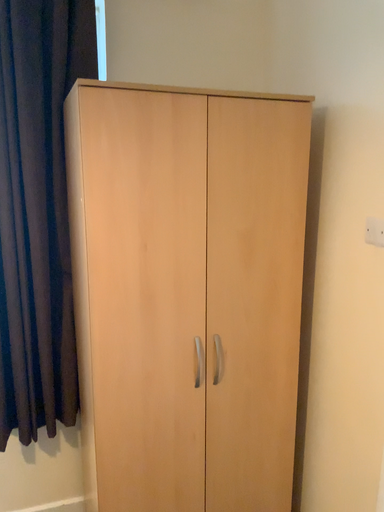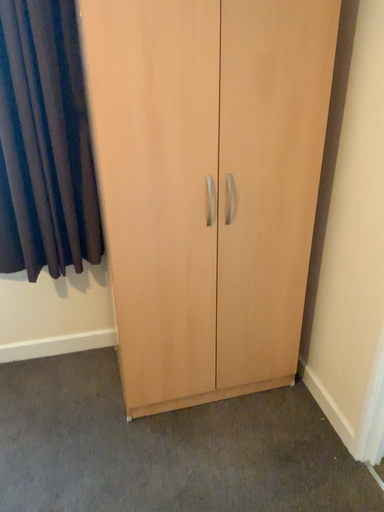
Question: How did the camera likely rotate when shooting the video?

Choices:
 (A) rotated upward
 (B) rotated downward

Answer: (B)